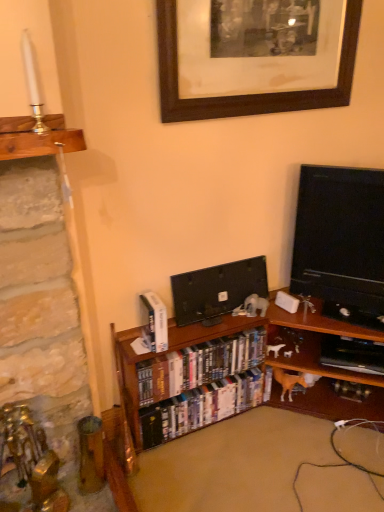
Locate an element on the screen. The width and height of the screenshot is (384, 512). wooden bookcase at center is located at coordinates (135, 378).

This screenshot has height=512, width=384. What do you see at coordinates (203, 406) in the screenshot?
I see `hardcover books at center, the third book positioned from the top` at bounding box center [203, 406].

Describe the element at coordinates (201, 365) in the screenshot. I see `shiny plastic dvds at center, the second book ordered from the bottom` at that location.

This screenshot has height=512, width=384. I want to click on white glossy book at center, placed as the 3th book when sorted from bottom to top, so click(x=156, y=321).

I want to click on wooden bookcase at center, so click(x=135, y=378).

Considering the points (267, 285) and (205, 357), which point is behind, point (267, 285) or point (205, 357)?

The point (267, 285) is behind.

From a real-world perspective, is black glossy flat-screen tv at center, placed as the second television when sorted from right to left, under shiny plastic dvds at center, positioned as the 2th book in top-to-bottom order?

No, from a real-world perspective, black glossy flat-screen tv at center, placed as the second television when sorted from right to left, is not beneath shiny plastic dvds at center, positioned as the 2th book in top-to-bottom order.

Is black glossy flat-screen tv at center, marked as the first television in a left-to-right arrangement, far from shiny plastic dvds at center, positioned as the 2th book in top-to-bottom order?

That's not correct — black glossy flat-screen tv at center, marked as the first television in a left-to-right arrangement, is a little close to shiny plastic dvds at center, positioned as the 2th book in top-to-bottom order.

Which object is further away from the camera taking this photo, black glossy flat-screen tv at center, marked as the first television in a left-to-right arrangement, or shiny plastic dvds at center, positioned as the 2th book in top-to-bottom order?

black glossy flat-screen tv at center, marked as the first television in a left-to-right arrangement, is more distant.

Considering the relative sizes of black glossy flat-screen tv at center, placed as the second television when sorted from right to left, and black glossy tv at right, which ranks as the 2th television in left-to-right order, in the image provided, is black glossy flat-screen tv at center, placed as the second television when sorted from right to left, bigger than black glossy tv at right, which ranks as the 2th television in left-to-right order,?

Incorrect, black glossy flat-screen tv at center, placed as the second television when sorted from right to left, is not larger than black glossy tv at right, which ranks as the 2th television in left-to-right order.

Is point (190, 298) more distant than point (355, 266)?

Yes, it is.

Is black glossy tv at right, which ranks as the 2th television in left-to-right order, at the back of black glossy flat-screen tv at center, marked as the first television in a left-to-right arrangement?

No.

Consider the image. Is the surface of black glossy flat-screen tv at center, placed as the second television when sorted from right to left, in direct contact with black glossy tv at right, which ranks as the 2th television in left-to-right order?

black glossy flat-screen tv at center, placed as the second television when sorted from right to left, and black glossy tv at right, which ranks as the 2th television in left-to-right order, are clearly separated.

Would you say hardcover books at center, acting as the 1th book starting from the bottom, is inside or outside wooden bookcase at center?

The correct answer is: inside.

Can you tell me how much hardcover books at center, the third book positioned from the top, and wooden bookcase at center differ in facing direction?

The facing directions of hardcover books at center, the third book positioned from the top, and wooden bookcase at center are 3.1 degrees apart.

Is the position of hardcover books at center, the third book positioned from the top, more distant than that of wooden bookcase at center?

Yes, the depth of hardcover books at center, the third book positioned from the top, is greater than that of wooden bookcase at center.

Considering the positions of point (147, 438) and point (124, 373), is point (147, 438) closer or farther from the camera than point (124, 373)?

Point (147, 438) appears to be farther away from the viewer than point (124, 373).

From a real-world perspective, which object rests below the other?

From a 3D spatial view, shiny plastic dvds at center, the second book ordered from the bottom, is below.

Which is correct: shiny plastic dvds at center, the second book ordered from the bottom, is inside white glossy book at center, placed as the 3th book when sorted from bottom to top, or outside of it?

shiny plastic dvds at center, the second book ordered from the bottom, is outside white glossy book at center, placed as the 3th book when sorted from bottom to top.

From the picture: Can you confirm if shiny plastic dvds at center, positioned as the 2th book in top-to-bottom order, is taller than white glossy book at center, placed as the 3th book when sorted from bottom to top?

Yes.

In the image, is shiny plastic dvds at center, positioned as the 2th book in top-to-bottom order, on the left side or the right side of white glossy book at center, placed as the first book when sorted from top to bottom?

Clearly, shiny plastic dvds at center, positioned as the 2th book in top-to-bottom order, is on the right of white glossy book at center, placed as the first book when sorted from top to bottom, in the image.

Based on the photo, from the image's perspective, which is above, hardcover books at center, the third book positioned from the top, or black wood picture frame at upper center?

black wood picture frame at upper center appears higher in the image.

Is hardcover books at center, the third book positioned from the top, facing away from black wood picture frame at upper center?

No, black wood picture frame at upper center is not at the back of hardcover books at center, the third book positioned from the top.

In the image, is hardcover books at center, acting as the 1th book starting from the bottom, positioned in front of or behind black wood picture frame at upper center?

hardcover books at center, acting as the 1th book starting from the bottom, is positioned farther from the viewer than black wood picture frame at upper center.

How much distance is there between shiny plastic dvds at center, the second book ordered from the bottom, and black wood picture frame at upper center?

shiny plastic dvds at center, the second book ordered from the bottom, and black wood picture frame at upper center are 3.50 feet apart from each other.

Are shiny plastic dvds at center, the second book ordered from the bottom, and black wood picture frame at upper center beside each other?

No, shiny plastic dvds at center, the second book ordered from the bottom, is not in contact with black wood picture frame at upper center.

Does point (207, 372) come in front of point (233, 10)?

No, (207, 372) is behind (233, 10).

From the image's perspective, which is below, shiny plastic dvds at center, positioned as the 2th book in top-to-bottom order, or black wood picture frame at upper center?

shiny plastic dvds at center, positioned as the 2th book in top-to-bottom order.

From a real-world perspective, is wooden bookcase at center physically located above or below black glossy flat-screen tv at center, marked as the first television in a left-to-right arrangement?

Clearly, from a real-world perspective, wooden bookcase at center is below black glossy flat-screen tv at center, marked as the first television in a left-to-right arrangement.

Does wooden bookcase at center appear on the left side of black glossy flat-screen tv at center, placed as the second television when sorted from right to left?

In fact, wooden bookcase at center is to the right of black glossy flat-screen tv at center, placed as the second television when sorted from right to left.

From the wooden bookcase at center, count 2nd televisions backward and point to it. Please provide its 2D coordinates.

[(217, 290)]

From the shiny plastic dvds at center, positioned as the 2th book in top-to-bottom order, count 1st television to the right and point to it. Please provide its 2D coordinates.

[(217, 290)]

Where is `television that is behind the black glossy tv at right, which ranks as the 2th television in left-to-right order`? The image size is (384, 512). television that is behind the black glossy tv at right, which ranks as the 2th television in left-to-right order is located at coordinates (217, 290).

Based on their spatial positions, is white glossy book at center, placed as the 3th book when sorted from bottom to top, or wooden bookcase at center closer to black glossy flat-screen tv at center, placed as the second television when sorted from right to left?

wooden bookcase at center is positioned closer to the anchor black glossy flat-screen tv at center, placed as the second television when sorted from right to left.

Based on the photo, which object lies nearer to the anchor point shiny plastic dvds at center, the second book ordered from the bottom, wooden bookcase at center or black glossy flat-screen tv at center, placed as the second television when sorted from right to left?

Based on the image, wooden bookcase at center appears to be nearer to shiny plastic dvds at center, the second book ordered from the bottom.

Estimate the real-world distances between objects in this image. Which object is further from shiny plastic dvds at center, the second book ordered from the bottom, black wood picture frame at upper center or hardcover books at center, acting as the 1th book starting from the bottom?

The object further to shiny plastic dvds at center, the second book ordered from the bottom, is black wood picture frame at upper center.

From the image, which object appears to be farther from white glossy book at center, placed as the first book when sorted from top to bottom, shiny plastic dvds at center, positioned as the 2th book in top-to-bottom order, or black glossy flat-screen tv at center, marked as the first television in a left-to-right arrangement?

The object further to white glossy book at center, placed as the first book when sorted from top to bottom, is black glossy flat-screen tv at center, marked as the first television in a left-to-right arrangement.

Considering their positions, is wooden bookcase at center positioned further to black glossy flat-screen tv at center, marked as the first television in a left-to-right arrangement, than white glossy book at center, placed as the 3th book when sorted from bottom to top?

The object further to black glossy flat-screen tv at center, marked as the first television in a left-to-right arrangement, is white glossy book at center, placed as the 3th book when sorted from bottom to top.

Considering their positions, is white glossy book at center, placed as the 3th book when sorted from bottom to top, positioned further to wooden bookcase at center than hardcover books at center, acting as the 1th book starting from the bottom?

white glossy book at center, placed as the 3th book when sorted from bottom to top, is further to wooden bookcase at center.

Looking at the image, which one is located closer to black glossy tv at right, the 1th television when ordered from right to left, white glossy book at center, placed as the 3th book when sorted from bottom to top, or wooden bookcase at center?

wooden bookcase at center lies closer to black glossy tv at right, the 1th television when ordered from right to left, than the other object.

Considering their positions, is black glossy tv at right, the 1th television when ordered from right to left, positioned further to shiny plastic dvds at center, the second book ordered from the bottom, than black wood picture frame at upper center?

black wood picture frame at upper center is positioned further to the anchor shiny plastic dvds at center, the second book ordered from the bottom.

At what (x,y) coordinates should I click in order to perform the action: click on bookcase that lies between black glossy tv at right, the 1th television when ordered from right to left, and hardcover books at center, acting as the 1th book starting from the bottom, from top to bottom. Please return your answer as a coordinate pair (x, y). This screenshot has width=384, height=512. Looking at the image, I should click on (135, 378).

What are the coordinates of `television between white glossy book at center, placed as the 3th book when sorted from bottom to top, and black glossy tv at right, the 1th television when ordered from right to left` in the screenshot? It's located at (217, 290).

Find the location of a particular element. The height and width of the screenshot is (512, 384). bookcase between white glossy book at center, placed as the 3th book when sorted from bottom to top, and black glossy tv at right, the 1th television when ordered from right to left, from left to right is located at coordinates (135, 378).

This screenshot has width=384, height=512. In order to click on book that lies between black glossy flat-screen tv at center, placed as the second television when sorted from right to left, and shiny plastic dvds at center, positioned as the 2th book in top-to-bottom order, from top to bottom in this screenshot , I will do `click(156, 321)`.